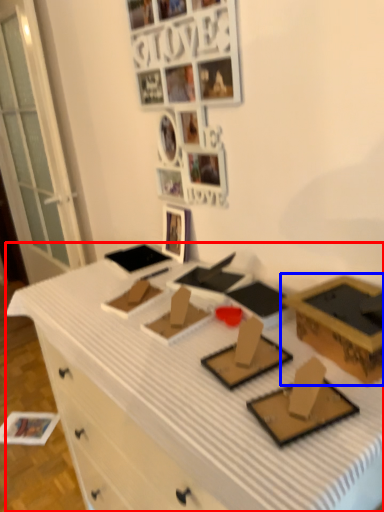
Question: Among these objects, which one is nearest to the camera, desk (highlighted by a red box) or box (highlighted by a blue box)?

Choices:
 (A) desk
 (B) box

Answer: (A)